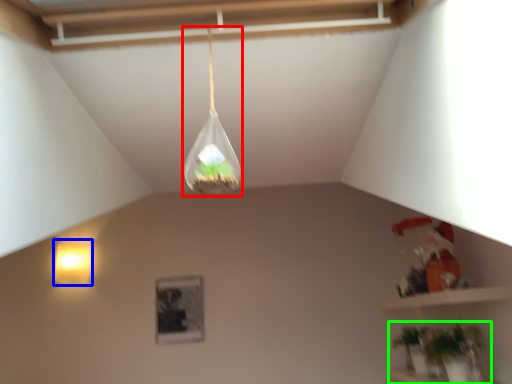
Question: Estimate the real-world distances between objects in this image. Which object is farther from lamp (highlighted by a red box), lamp (highlighted by a blue box) or houseplant (highlighted by a green box)?

Choices:
 (A) lamp
 (B) houseplant

Answer: (A)